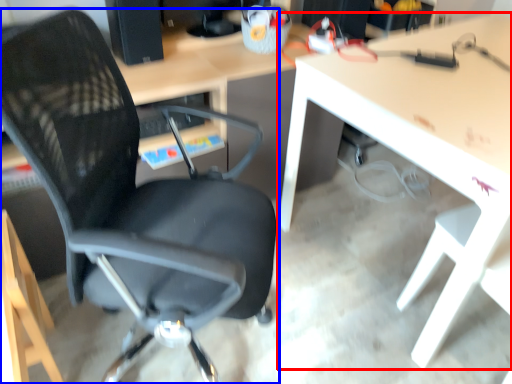
Question: Among these objects, which one is farthest to the camera, table (highlighted by a red box) or chair (highlighted by a blue box)?

Choices:
 (A) table
 (B) chair

Answer: (A)